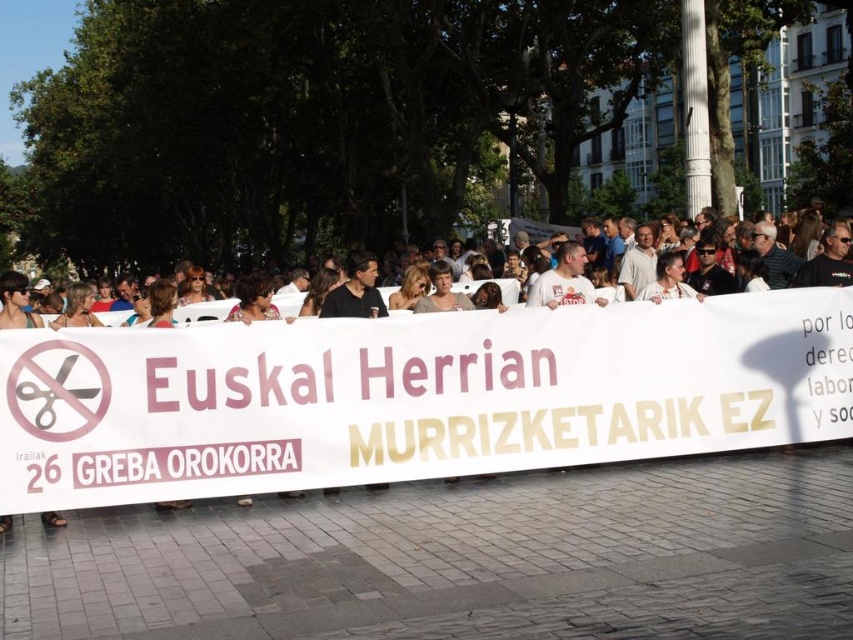
You are a journalist covering the demonstration and need to describe the banners. Which banner is taller, the white paper banner at center or the white cloth banner at center?

The white paper banner at center is taller than the white cloth banner at center.

You are a journalist covering the demonstration and want to take a photo that captures both the white paper banner at center and the white cloth banner at center. Which banner should you focus on to ensure both are visible in the frame?

Since the white paper banner at center occupies less space than the white cloth banner at center, you should focus on the white cloth banner at center to ensure both banners are visible in the frame.

What is the relationship between the white paper banner at center and the white cloth banner at center in terms of their positioning?

The white paper banner at center is in front of the white cloth banner at center, meaning it is closer to the observer and obscures part of the cloth banner behind it.